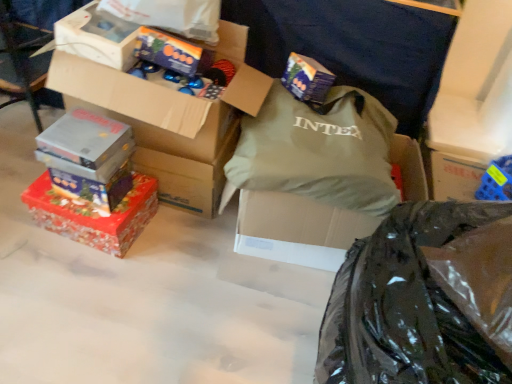
Question: From the image's perspective, is metallic silver box at left, which appears as the 6th box when viewed from the right, above or below shiny red wrapping paper at lower left, placed as the seventh box when sorted from right to left?

Choices:
 (A) below
 (B) above

Answer: (B)

Question: Choose the correct answer: Is metallic silver box at left, which appears as the 6th box when viewed from the right, inside shiny red wrapping paper at lower left, placed as the seventh box when sorted from right to left, or outside it?

Choices:
 (A) outside
 (B) inside

Answer: (A)

Question: Which of these objects is positioned closest to the matte purple box at upper center?

Choices:
 (A) green fabric bag at center
 (B) white plastic box at upper left, acting as the fourth box starting from the right
 (C) cardboard box at upper left, the 3th box viewed from the right
 (D) shiny metallic box at upper center, positioned as the 2th box in right-to-left order
 (E) shiny red wrapping paper at lower left, placed as the seventh box when sorted from right to left

Answer: (A)

Question: Which object is positioned closest to the matte purple box at upper center?

Choices:
 (A) matte green pillow at center, acting as the 7th box starting from the left
 (B) cardboard box at upper left, the 3th box viewed from the right
 (C) shiny metallic box at lower left, which appears as the third box when viewed from the left
 (D) shiny red wrapping paper at lower left, the 1th box when ordered from left to right
 (E) metallic silver box at left, which appears as the 6th box when viewed from the right

Answer: (B)